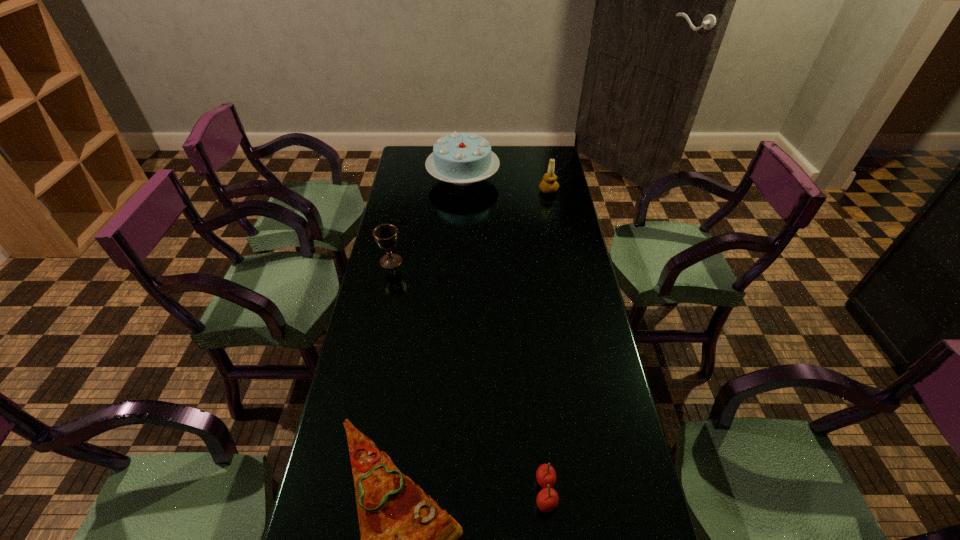
Locate an element on the screen. The width and height of the screenshot is (960, 540). object that can be found as the second closest to the candle_holder is located at coordinates (386, 235).

Identify which object is the nearest to the pizza. Please provide its 2D coordinates. Your answer should be formatted as a tuple, i.e. [(x, y)], where the tuple contains the x and y coordinates of a point satisfying the conditions above.

[(547, 499)]

Find the location of `free space in the image that satisfies the following two spatial constraints: 1. on the front side of the tallest object; 2. on the right side of the candle_holder`. free space in the image that satisfies the following two spatial constraints: 1. on the front side of the tallest object; 2. on the right side of the candle_holder is located at coordinates (463, 191).